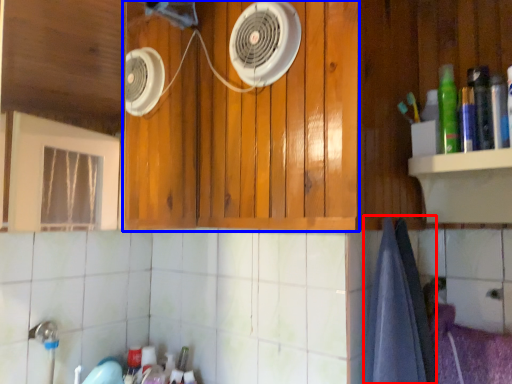
Question: Among these objects, which one is farthest to the camera, bath towel (highlighted by a red box) or cabinetry (highlighted by a blue box)?

Choices:
 (A) bath towel
 (B) cabinetry

Answer: (B)